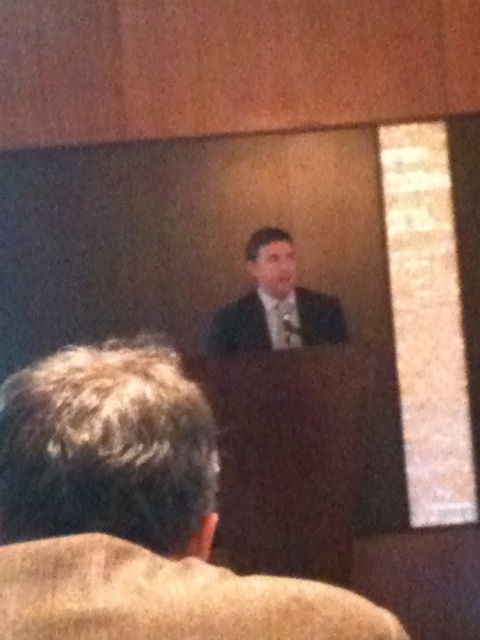
Is dark suit at center thinner than matte black suit at center?

Yes, dark suit at center is thinner than matte black suit at center.

Does dark suit at center lie behind matte black suit at center?

No, dark suit at center is in front of matte black suit at center.

Which is in front, point (1, 433) or point (290, 339)?

Point (1, 433) is in front.

I want to click on dark suit at center, so click(133, 513).